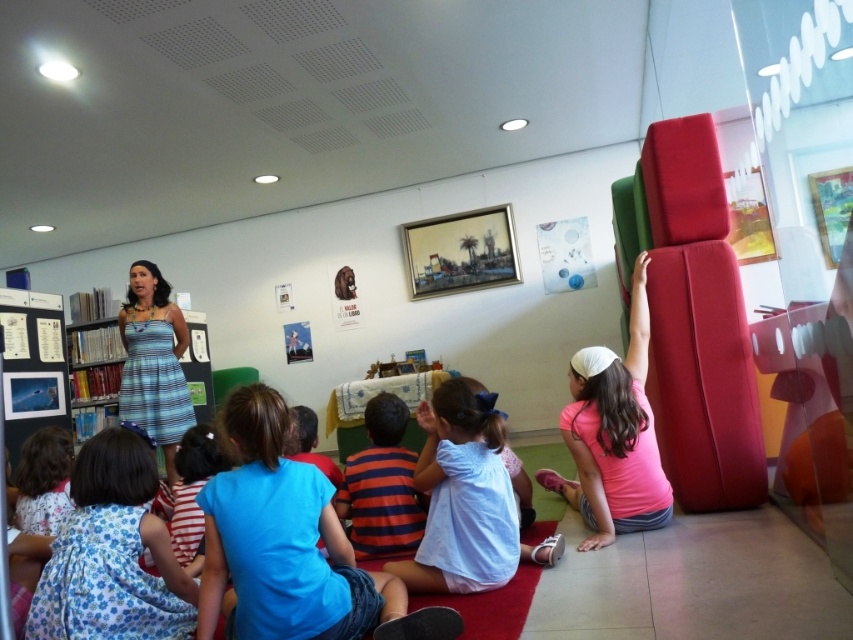
Question: Which object appears closest to the camera in this image?

Choices:
 (A) light blue cotton shirt at center
 (B) blue striped dress at center
 (C) blue striped fabric bookshelf at left

Answer: (A)

Question: Does light blue cotton shirt at center have a lesser width compared to blue striped fabric bookshelf at left?

Choices:
 (A) yes
 (B) no

Answer: (B)

Question: Which object is farther from the camera taking this photo?

Choices:
 (A) pink matte shirt at right
 (B) floral cotton dress at lower left
 (C) blue striped dress at center

Answer: (C)

Question: Can you confirm if pink matte shirt at right is wider than blue striped fabric bookshelf at left?

Choices:
 (A) no
 (B) yes

Answer: (A)

Question: Among these points, which one is nearest to the camera?

Choices:
 (A) (93, 326)
 (B) (230, 506)
 (C) (341, 516)

Answer: (B)

Question: Can you confirm if striped cotton shirt at center is positioned to the right of blue striped fabric bookshelf at left?

Choices:
 (A) no
 (B) yes

Answer: (B)